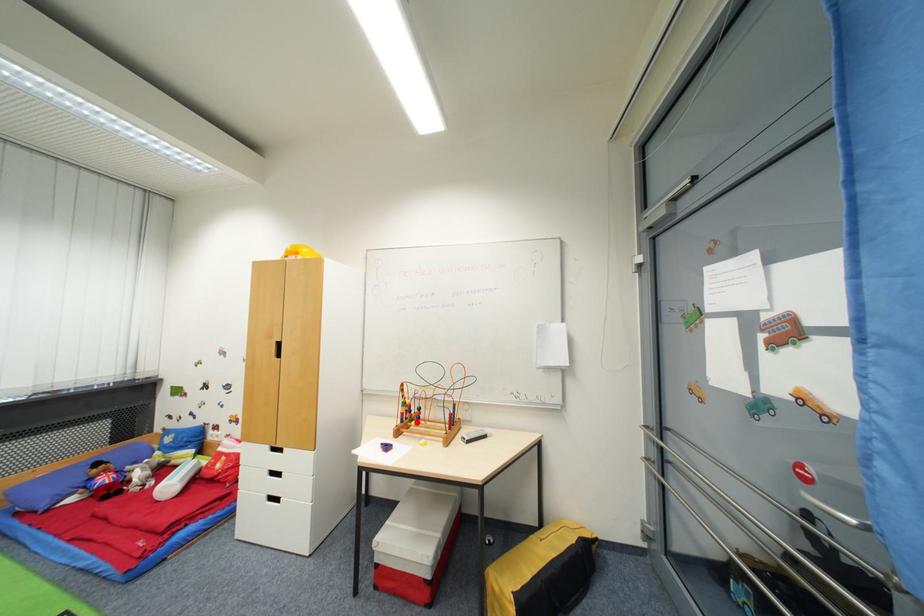
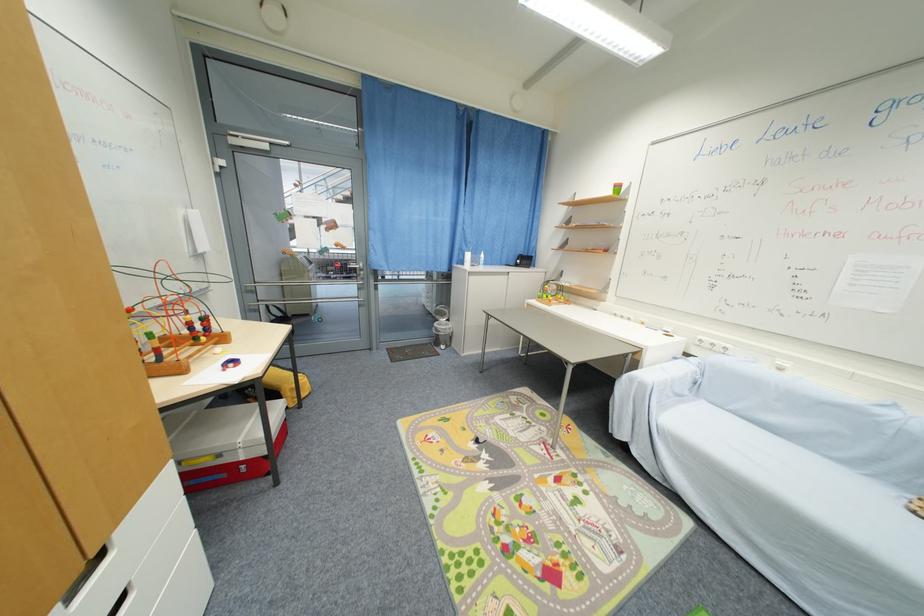
Question: A red point is marked in image1. In image2, is the corresponding 3D point closer to the camera or farther? Reply with the corresponding letter.

Choices:
 (A) The corresponding 3D point is closer.
 (B) The corresponding 3D point is farther.

Answer: (A)